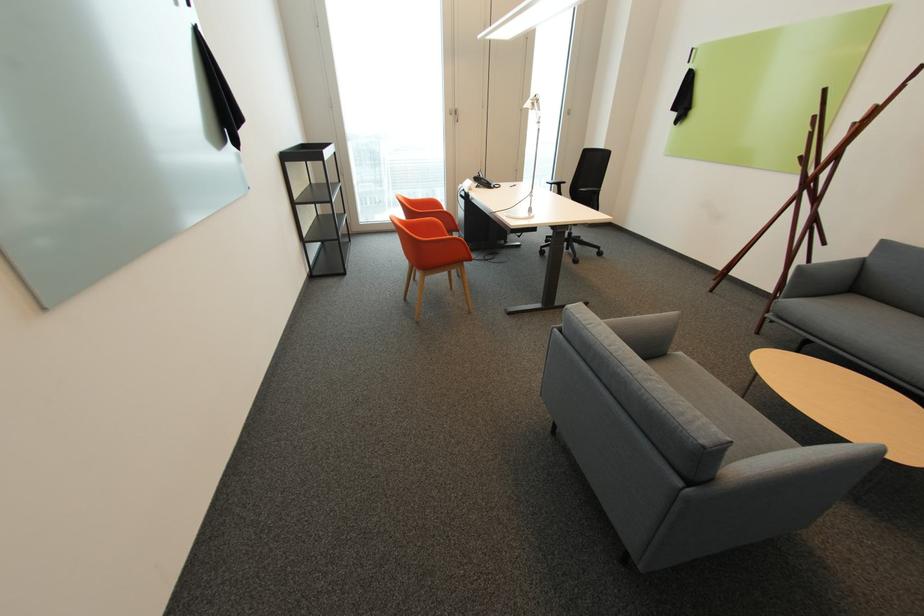
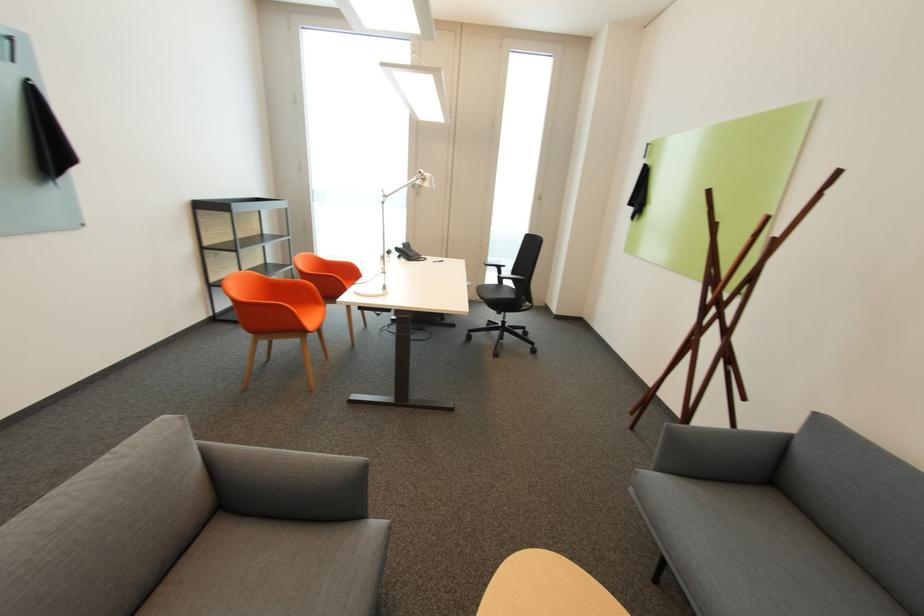
In the second image, find the point that corresponds to pixel 793 298 in the first image.

(663, 469)